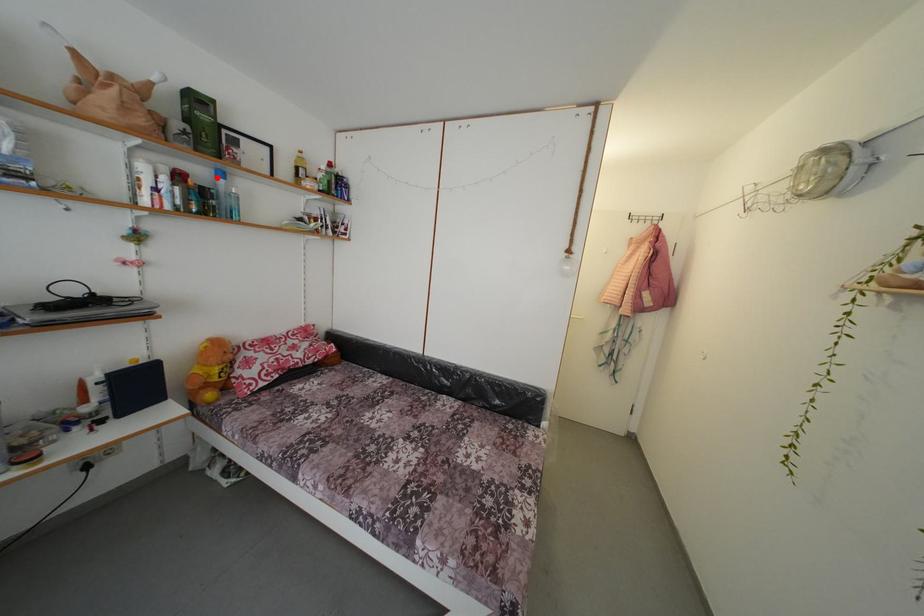
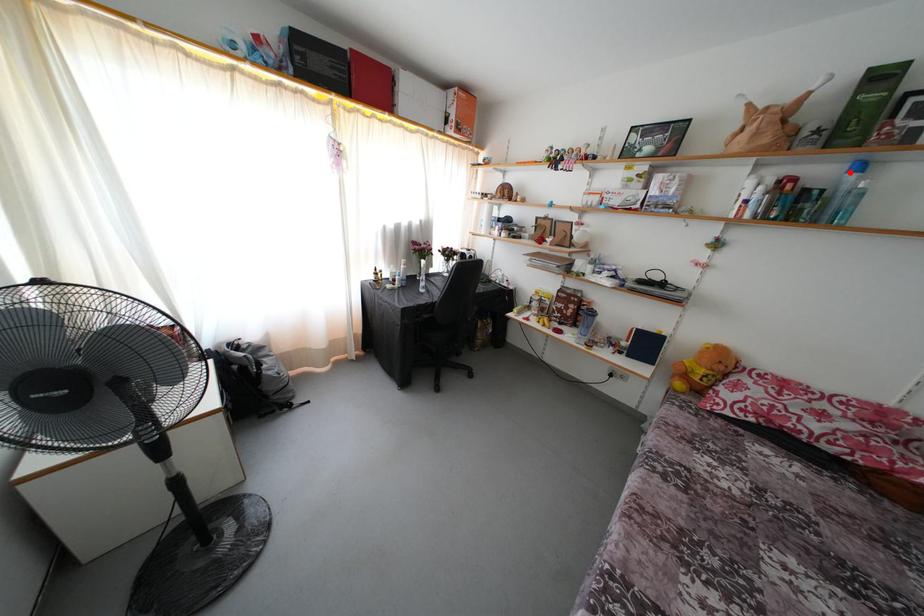
I am providing you with two images of the same scene from different viewpoints. A red point is marked on the first image and another point is marked on the second image. Are the points marked in image1 and image2 representing the same 3D position?

Yes